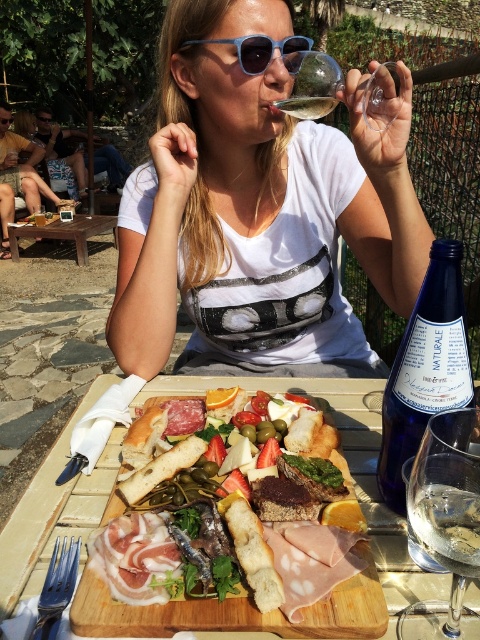
You are a waiter at this outdoor dining area. You need to serve a customer who is seated at the table with the transparent glass at upper center and clear glass wine at upper center. Which glass should you refill first based on their positions?

The transparent glass at upper center is located above the clear glass wine at upper center, so you should refill the transparent glass at upper center first as it is positioned higher and likely corresponds to the drink the customer is currently using.

What is located at the point with coordinates (230, 618) in the image?

The wooden cutting board with assorted charcuterie is located at the point with coordinates (230, 618) in the image.